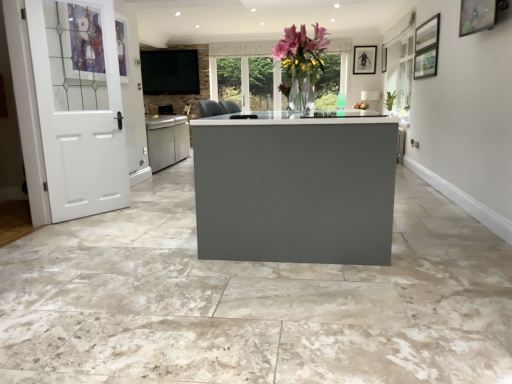
Image resolution: width=512 pixels, height=384 pixels. I want to click on vacant space in front of white painted wood door at left, so click(x=81, y=229).